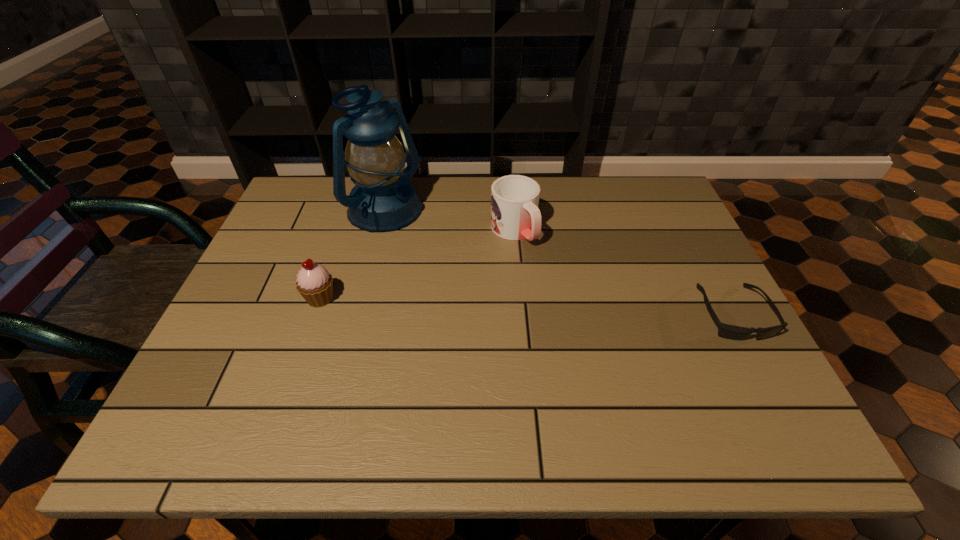
Locate an element on the screen. vacant area situated on the side of the mug with the handle is located at coordinates (549, 275).

This screenshot has width=960, height=540. Identify the location of free spot located 0.320m on the side of the mug with the handle. (601, 335).

I want to click on vacant space located on the side of the mug with the handle, so click(544, 270).

Find the location of a particular element. The width and height of the screenshot is (960, 540). lantern that is at the far edge is located at coordinates (383, 199).

At what (x,y) coordinates should I click in order to perform the action: click on mug present at the far edge. Please return your answer as a coordinate pair (x, y). Image resolution: width=960 pixels, height=540 pixels. Looking at the image, I should click on (515, 215).

Where is `object that is at the left edge`? Image resolution: width=960 pixels, height=540 pixels. object that is at the left edge is located at coordinates (315, 284).

At what (x,y) coordinates should I click in order to perform the action: click on object at the right edge. Please return your answer as a coordinate pair (x, y). The width and height of the screenshot is (960, 540). Looking at the image, I should click on (726, 331).

Where is `free space at the far edge of the desktop`? Image resolution: width=960 pixels, height=540 pixels. free space at the far edge of the desktop is located at coordinates (460, 207).

The image size is (960, 540). Find the location of `blank space at the near edge of the desktop`. blank space at the near edge of the desktop is located at coordinates (321, 379).

This screenshot has height=540, width=960. Identify the location of free space at the left edge of the desktop. (265, 354).